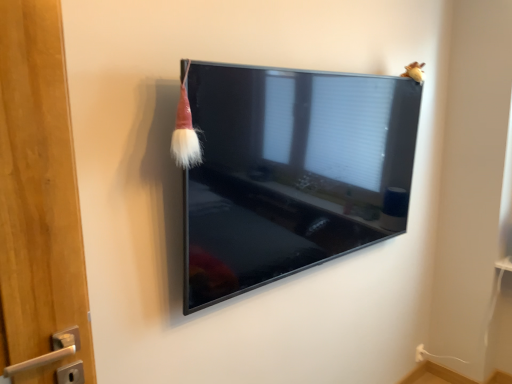
Where is `matte black tv at center`? The height and width of the screenshot is (384, 512). matte black tv at center is located at coordinates (291, 172).

At what (x,y) coordinates should I click in order to perform the action: click on white plastic electric outlet at lower right. Please return your answer as a coordinate pair (x, y). The image size is (512, 384). Looking at the image, I should click on (419, 353).

The image size is (512, 384). I want to click on fuzzy yellow toy at upper right, so click(x=414, y=72).

The image size is (512, 384). Identify the location of matte black tv at center. (291, 172).

Where is `brush that appears above the white plastic electric outlet at lower right (from a real-world perspective)`? brush that appears above the white plastic electric outlet at lower right (from a real-world perspective) is located at coordinates (185, 132).

Can you confirm if red velvet brush at upper left is smaller than white plastic electric outlet at lower right?

Actually, red velvet brush at upper left might be larger than white plastic electric outlet at lower right.

Is red velvet brush at upper left positioned in front of white plastic electric outlet at lower right?

Yes, the depth of red velvet brush at upper left is less than that of white plastic electric outlet at lower right.

Which of these two, red velvet brush at upper left or white plastic electric outlet at lower right, stands shorter?

Standing shorter between the two is white plastic electric outlet at lower right.

Is fuzzy yellow toy at upper right placed right next to red velvet brush at upper left?

There is a gap between fuzzy yellow toy at upper right and red velvet brush at upper left.

I want to click on animal above the red velvet brush at upper left (from the image's perspective), so click(414, 72).

From the image's perspective, which is above, fuzzy yellow toy at upper right or red velvet brush at upper left?

fuzzy yellow toy at upper right appears higher in the image.

Is red velvet brush at upper left directly adjacent to matte black tv at center?

No, red velvet brush at upper left is not in contact with matte black tv at center.

Which of these two, red velvet brush at upper left or matte black tv at center, is thinner?

With smaller width is red velvet brush at upper left.

Can you confirm if red velvet brush at upper left is smaller than matte black tv at center?

Indeed, red velvet brush at upper left has a smaller size compared to matte black tv at center.

Could you tell me if white plastic electric outlet at lower right is facing fuzzy yellow toy at upper right?

No.

Between white plastic electric outlet at lower right and fuzzy yellow toy at upper right, which one has larger size?

With larger size is fuzzy yellow toy at upper right.

Which of these two, white plastic electric outlet at lower right or fuzzy yellow toy at upper right, stands shorter?

fuzzy yellow toy at upper right is shorter.

From a real-world perspective, is white plastic electric outlet at lower right physically below fuzzy yellow toy at upper right?

Yes.

From the image's perspective, between matte black tv at center and fuzzy yellow toy at upper right, which one is located above?

fuzzy yellow toy at upper right.

Considering the sizes of objects matte black tv at center and fuzzy yellow toy at upper right in the image provided, who is bigger, matte black tv at center or fuzzy yellow toy at upper right?

matte black tv at center is bigger.

Does matte black tv at center have a greater width compared to fuzzy yellow toy at upper right?

Yes, matte black tv at center is wider than fuzzy yellow toy at upper right.

Does point (268, 261) lie in front of point (418, 68)?

Yes, it is.

Would you say white plastic electric outlet at lower right contains matte black tv at center?

No, matte black tv at center is located outside of white plastic electric outlet at lower right.

Is white plastic electric outlet at lower right facing away from matte black tv at center?

No, white plastic electric outlet at lower right is not facing away from matte black tv at center.

Does white plastic electric outlet at lower right have a lesser height compared to matte black tv at center?

Yes, white plastic electric outlet at lower right is shorter than matte black tv at center.

Is matte black tv at center looking in the opposite direction of white plastic electric outlet at lower right?

No, matte black tv at center is not facing the opposite direction of white plastic electric outlet at lower right.

Which of these two, matte black tv at center or white plastic electric outlet at lower right, stands taller?

With more height is matte black tv at center.

Is matte black tv at center placed right next to white plastic electric outlet at lower right?

No, matte black tv at center is not touching white plastic electric outlet at lower right.

The width and height of the screenshot is (512, 384). In order to click on electric outlet below the red velvet brush at upper left (from a real-world perspective) in this screenshot , I will do `click(419, 353)`.

Locate an element on the screen. animal behind the red velvet brush at upper left is located at coordinates (414, 72).

Estimate the real-world distances between objects in this image. Which object is further from white plastic electric outlet at lower right, red velvet brush at upper left or matte black tv at center?

The object further to white plastic electric outlet at lower right is red velvet brush at upper left.

Looking at the image, which one is located further to red velvet brush at upper left, white plastic electric outlet at lower right or matte black tv at center?

Among the two, white plastic electric outlet at lower right is located further to red velvet brush at upper left.

Considering their positions, is white plastic electric outlet at lower right positioned closer to matte black tv at center than fuzzy yellow toy at upper right?

fuzzy yellow toy at upper right is positioned closer to the anchor matte black tv at center.

Based on their spatial positions, is red velvet brush at upper left or matte black tv at center further from fuzzy yellow toy at upper right?

red velvet brush at upper left is further to fuzzy yellow toy at upper right.

When comparing their distances from white plastic electric outlet at lower right, does fuzzy yellow toy at upper right or matte black tv at center seem further?

matte black tv at center lies further to white plastic electric outlet at lower right than the other object.

Estimate the real-world distances between objects in this image. Which object is further from fuzzy yellow toy at upper right, white plastic electric outlet at lower right or matte black tv at center?

white plastic electric outlet at lower right is further to fuzzy yellow toy at upper right.

Looking at the image, which one is located closer to matte black tv at center, red velvet brush at upper left or fuzzy yellow toy at upper right?

red velvet brush at upper left.

From the image, which object appears to be farther from fuzzy yellow toy at upper right, white plastic electric outlet at lower right or red velvet brush at upper left?

The object further to fuzzy yellow toy at upper right is white plastic electric outlet at lower right.

Identify the location of television situated between red velvet brush at upper left and fuzzy yellow toy at upper right from left to right. This screenshot has width=512, height=384. (291, 172).

Identify the location of television between fuzzy yellow toy at upper right and white plastic electric outlet at lower right from top to bottom. This screenshot has height=384, width=512. (291, 172).

The height and width of the screenshot is (384, 512). Find the location of `television between red velvet brush at upper left and white plastic electric outlet at lower right in the front-back direction`. television between red velvet brush at upper left and white plastic electric outlet at lower right in the front-back direction is located at coordinates (291, 172).

Where is `brush that lies between fuzzy yellow toy at upper right and white plastic electric outlet at lower right from top to bottom`? This screenshot has height=384, width=512. brush that lies between fuzzy yellow toy at upper right and white plastic electric outlet at lower right from top to bottom is located at coordinates (185, 132).